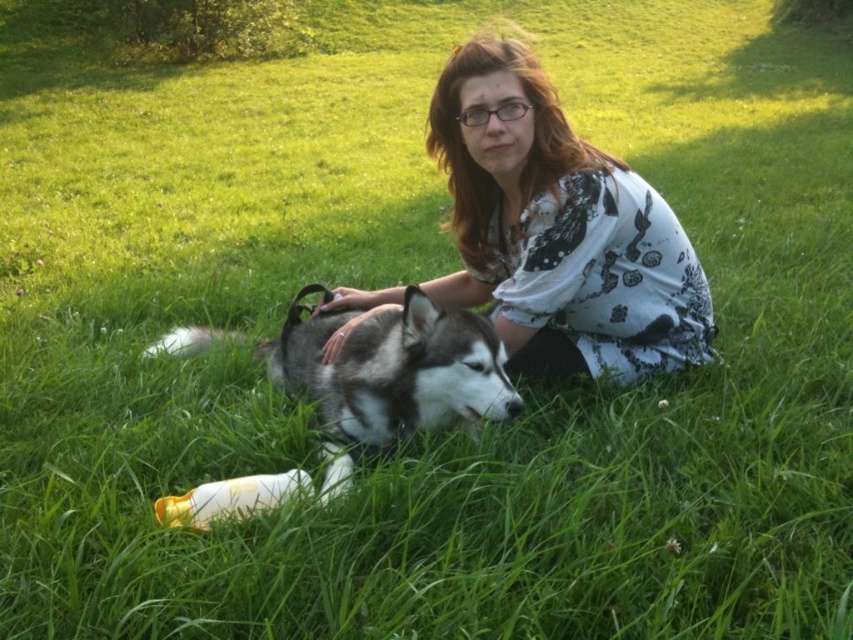
Question: Does white floral shirt at center lie in front of gray-furred husky at center?

Choices:
 (A) no
 (B) yes

Answer: (A)

Question: Does white floral shirt at center lie in front of gray-furred husky at center?

Choices:
 (A) yes
 (B) no

Answer: (B)

Question: Which object appears farthest from the camera in this image?

Choices:
 (A) white plastic bottle at lower center
 (B) white floral shirt at center
 (C) gray-furred husky at center

Answer: (B)

Question: Which object appears closest to the camera in this image?

Choices:
 (A) white plastic bottle at lower center
 (B) white floral shirt at center

Answer: (A)

Question: Can you confirm if white floral shirt at center is thinner than white plastic bottle at lower center?

Choices:
 (A) yes
 (B) no

Answer: (B)

Question: Estimate the real-world distances between objects in this image. Which object is closer to the gray-furred husky at center?

Choices:
 (A) white plastic bottle at lower center
 (B) white floral shirt at center

Answer: (B)